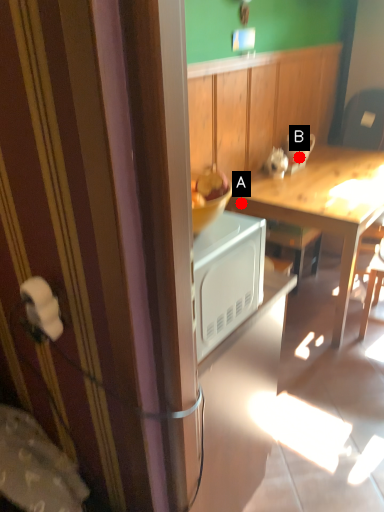
Question: Two points are circled on the image, labeled by A and B beside each circle. Which of the following is the farthest from the observer?

Choices:
 (A) A is further
 (B) B is further

Answer: (B)